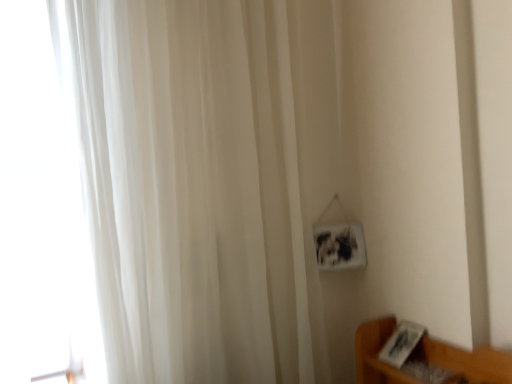
Question: Relative to white sheer curtain at left, is transparent glass door at left in front or behind?

Choices:
 (A) behind
 (B) front

Answer: (A)

Question: Is transparent glass door at left inside the boundaries of white sheer curtain at left, or outside?

Choices:
 (A) outside
 (B) inside

Answer: (A)

Question: From the image's perspective, is transparent glass door at left above or below white sheer curtain at left?

Choices:
 (A) below
 (B) above

Answer: (B)

Question: Is white sheer curtain at left inside the boundaries of transparent glass door at left, or outside?

Choices:
 (A) outside
 (B) inside

Answer: (A)

Question: From the image's perspective, relative to transparent glass door at left, is white sheer curtain at left above or below?

Choices:
 (A) above
 (B) below

Answer: (B)

Question: From their relative heights in the image, would you say white sheer curtain at left is taller or shorter than transparent glass door at left?

Choices:
 (A) tall
 (B) short

Answer: (A)

Question: Is white sheer curtain at left in front of or behind transparent glass door at left in the image?

Choices:
 (A) behind
 (B) front

Answer: (B)